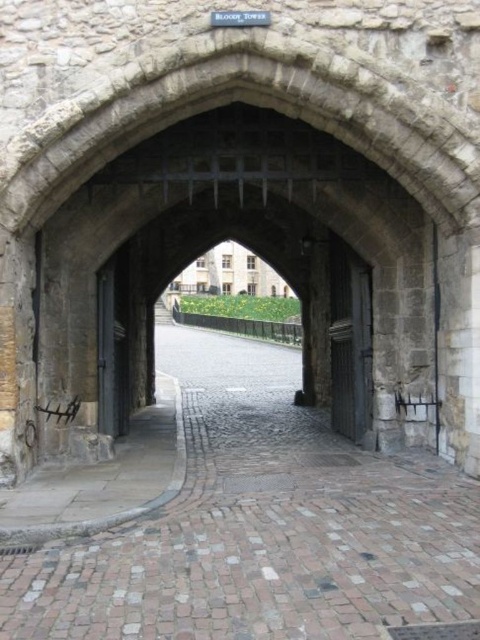
Which is behind, point (272, 609) or point (350, 432)?

The point (350, 432) is behind.

Which is more to the left, cobblestone path at center or dark gray stone door at center?

Positioned to the left is cobblestone path at center.

Where is `cobblestone path at center`? The image size is (480, 640). cobblestone path at center is located at coordinates tap(261, 525).

In order to click on cobblestone path at center in this screenshot , I will do `click(261, 525)`.

Does cobblestone path at center have a smaller size compared to dark gray metal door at left?

Incorrect, cobblestone path at center is not smaller in size than dark gray metal door at left.

Who is positioned more to the right, cobblestone path at center or dark gray metal door at left?

cobblestone path at center

Between point (238, 451) and point (106, 301), which one is positioned in front?

Point (238, 451)

Where is `cobblestone path at center`? This screenshot has width=480, height=640. cobblestone path at center is located at coordinates (261, 525).

Which is in front, point (351, 380) or point (115, 388)?

Point (351, 380) is more forward.

Is dark gray stone door at center behind dark gray metal door at left?

That is True.

Does point (355, 376) lie behind point (96, 355)?

That is True.

In order to click on dark gray stone door at center in this screenshot , I will do `click(349, 340)`.